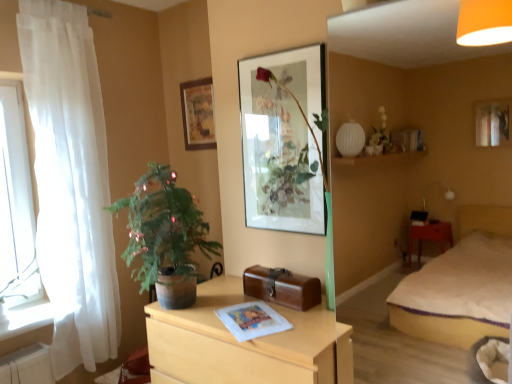
Question: From a real-world perspective, is white sheer curtain at left positioned above or below brown leather suitcase at center?

Choices:
 (A) above
 (B) below

Answer: (A)

Question: Considering their positions, is white sheer curtain at left located in front of or behind brown leather suitcase at center?

Choices:
 (A) behind
 (B) front

Answer: (A)

Question: Which object is positioned farthest from the wooden picture frame at upper center, marked as the first picture frame in a back-to-front arrangement?

Choices:
 (A) transparent glass window at left
 (B) white sheer curtain at left
 (C) wooden chest of drawers at center
 (D) matte glass picture frame at center, placed as the first picture frame when sorted from right to left
 (E) green matte potted plant at left

Answer: (C)

Question: Which is farther from the brown leather suitcase at center?

Choices:
 (A) matte glass picture frame at center, the 2th picture frame from the left
 (B) white sheer curtain at left
 (C) green matte potted plant at left
 (D) wooden chest of drawers at center
 (E) transparent glass window at left

Answer: (E)